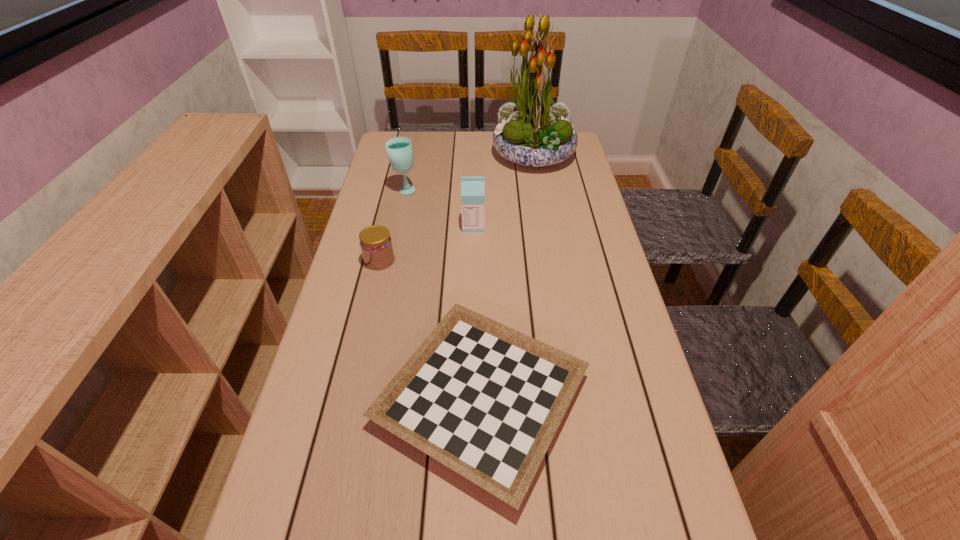
This screenshot has height=540, width=960. I want to click on free space located on the right of the glass, so click(x=468, y=190).

Where is `vacant space situated on the left of the milk carton`? The height and width of the screenshot is (540, 960). vacant space situated on the left of the milk carton is located at coordinates (380, 226).

Locate an element on the screen. The width and height of the screenshot is (960, 540). vacant space located 0.070m on the front of the jam is located at coordinates coord(372,290).

Locate an element on the screen. This screenshot has width=960, height=540. vacant space located 0.110m on the right of the checkerboard is located at coordinates (643, 400).

The height and width of the screenshot is (540, 960). I want to click on object that is at the far edge, so click(x=532, y=131).

Where is `glass located at the left edge`? Image resolution: width=960 pixels, height=540 pixels. glass located at the left edge is located at coordinates (399, 149).

The height and width of the screenshot is (540, 960). Find the location of `jam that is at the left edge`. jam that is at the left edge is located at coordinates (376, 245).

This screenshot has height=540, width=960. I want to click on checkerboard at the left edge, so click(485, 400).

What are the coordinates of `flower arrangement at the right edge` in the screenshot? It's located at (532, 131).

I want to click on checkerboard present at the right edge, so click(485, 400).